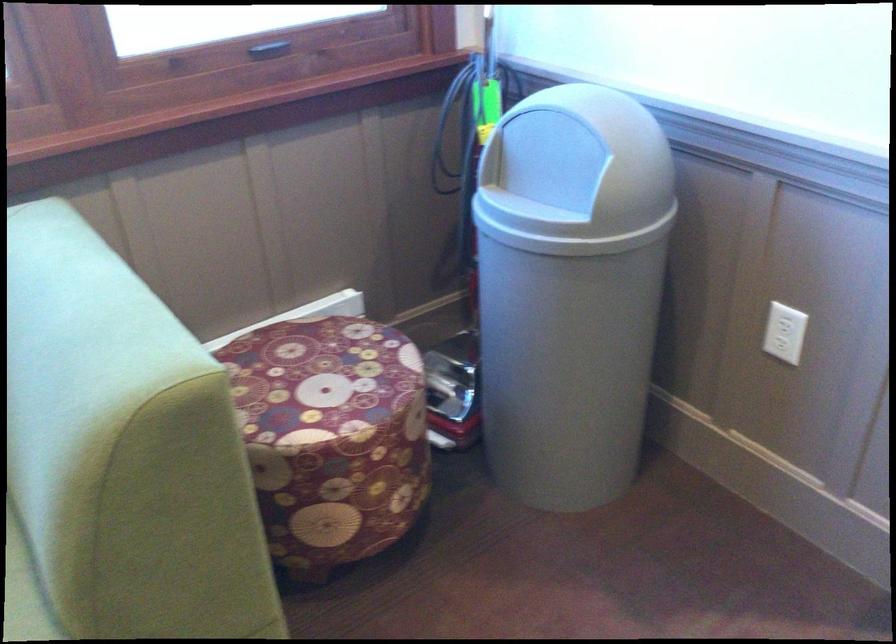
This screenshot has height=644, width=896. I want to click on electrical outlet socket, so click(787, 328).